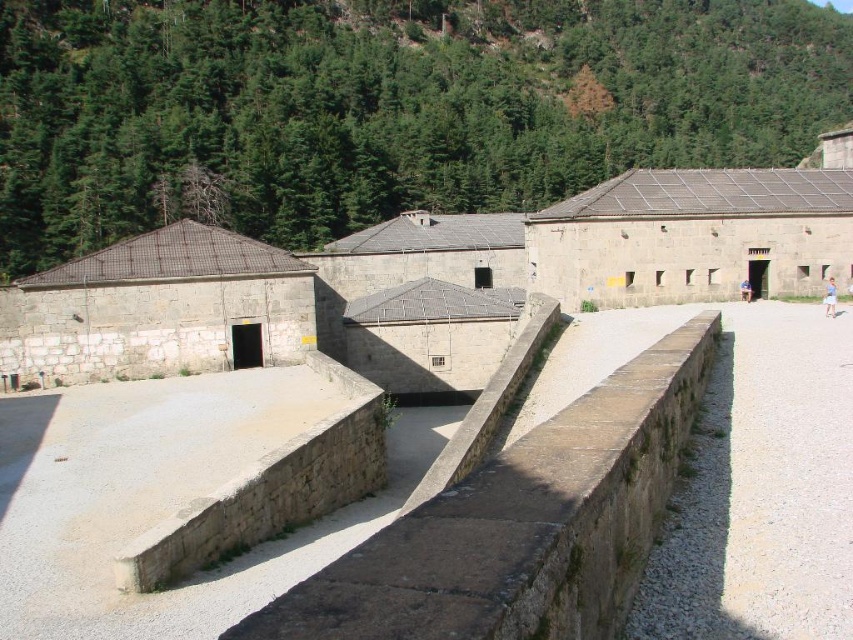
Does brown stone ledge at center appear over blue denim jeans at center?

Actually, brown stone ledge at center is below blue denim jeans at center.

Can you confirm if brown stone ledge at center is thinner than blue denim jeans at center?

Incorrect, brown stone ledge at center's width is not less than blue denim jeans at center's.

This screenshot has width=853, height=640. What are the coordinates of `brown stone ledge at center` in the screenshot? It's located at (523, 524).

Who is positioned more to the left, stone wall at left or blue cotton dress at center-right?

Positioned to the left is stone wall at left.

Consider the image. Can you confirm if stone wall at left is bigger than blue cotton dress at center-right?

Indeed, stone wall at left has a larger size compared to blue cotton dress at center-right.

Between point (228, 256) and point (824, 296), which one is positioned behind?

The point (824, 296) is more distant.

What are the coordinates of `stone wall at left` in the screenshot? It's located at (426, 269).

Is brown stone ledge at center positioned behind brown stone wall at center?

That is False.

Can you confirm if brown stone ledge at center is taller than brown stone wall at center?

Yes, brown stone ledge at center is taller than brown stone wall at center.

Who is more distant from viewer, (531, 605) or (637, 588)?

Point (637, 588)

You are a GUI agent. You are given a task and a screenshot of the screen. Output one action in this format:
    pyautogui.click(x=<x>, y=<y>)
    Task: Click on the brown stone ledge at center
    This screenshot has width=853, height=640.
    Given the screenshot: What is the action you would take?
    pyautogui.click(x=523, y=524)